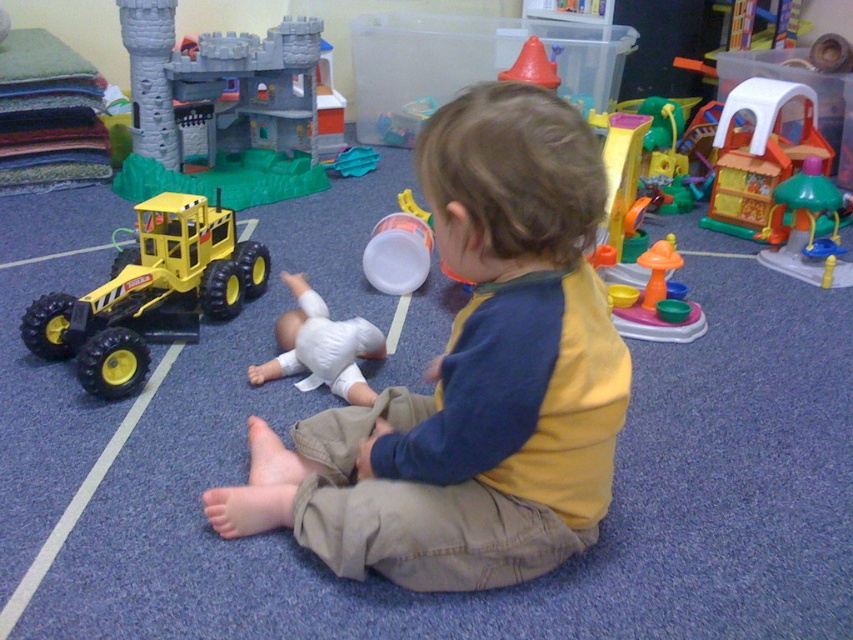
Can you confirm if yellow cotton shirt at center is thinner than yellow matte toy car at left?

No, yellow cotton shirt at center is not thinner than yellow matte toy car at left.

Is yellow cotton shirt at center behind yellow matte toy car at left?

No, yellow cotton shirt at center is in front of yellow matte toy car at left.

Describe the element at coordinates (473, 378) in the screenshot. I see `yellow cotton shirt at center` at that location.

Locate an element on the screen. yellow cotton shirt at center is located at coordinates (473, 378).

Does point (805, 115) lie in front of point (833, 243)?

No, (805, 115) is behind (833, 243).

Which is in front, point (761, 170) or point (827, 208)?

Point (827, 208) is in front.

Find the location of `plastic playhouse at center`. plastic playhouse at center is located at coordinates (758, 154).

From the picture: Is plastic playhouse at center to the right of multicolored plastic playset at center from the viewer's perspective?

Yes, plastic playhouse at center is to the right of multicolored plastic playset at center.

Who is more distant from viewer, (811, 128) or (621, 326)?

The point (811, 128) is behind.

Between point (816, 144) and point (648, 328), which one is positioned behind?

The point (816, 144) is behind.

In order to click on plastic playhouse at center in this screenshot , I will do (x=758, y=154).